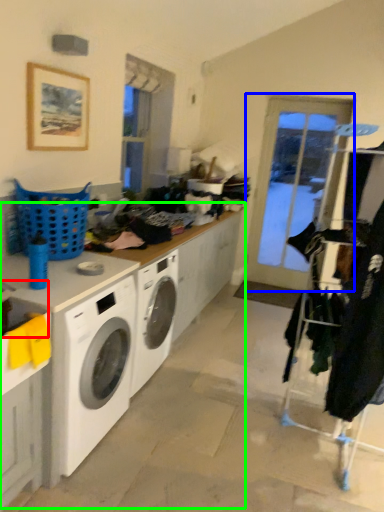
Question: Estimate the real-world distances between objects in this image. Which object is closer to sink (highlighted by a red box), screen door (highlighted by a blue box) or counter top (highlighted by a green box)?

Choices:
 (A) screen door
 (B) counter top

Answer: (B)